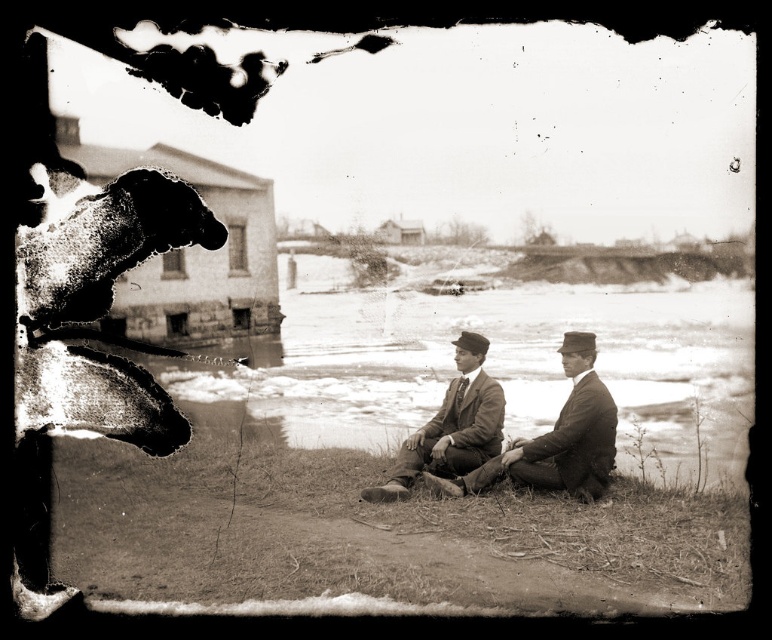
Is frothy white water at center thinner than brown leather jacket at center?

Incorrect, frothy white water at center's width is not less than brown leather jacket at center's.

Is frothy white water at center taller than brown leather jacket at center?

Yes.

Is point (371, 390) closer to camera compared to point (408, 474)?

No, (371, 390) is behind (408, 474).

This screenshot has width=772, height=640. What are the coordinates of `frothy white water at center` in the screenshot? It's located at (493, 368).

Between point (557, 428) and point (466, 461), which one is positioned behind?

Point (466, 461)

Where is `smooth brown suit at center`? smooth brown suit at center is located at coordinates (557, 438).

Is frothy white water at center closer to the viewer compared to smooth brown suit at center?

Yes.

The width and height of the screenshot is (772, 640). Describe the element at coordinates (493, 368) in the screenshot. I see `frothy white water at center` at that location.

Where is `frothy white water at center`? frothy white water at center is located at coordinates (493, 368).